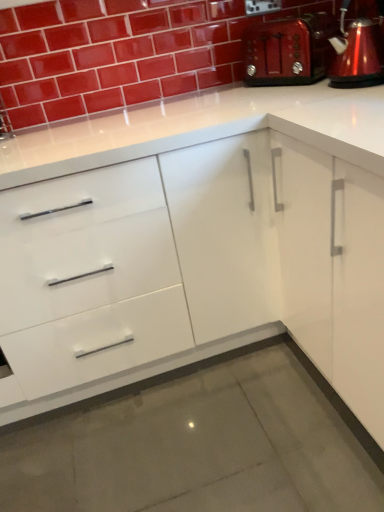
Question: Is glossy ceramic brick at upper center inside or outside of metallic red toaster at upper right?

Choices:
 (A) outside
 (B) inside

Answer: (A)

Question: Considering the positions of glossy ceramic brick at upper center and metallic red toaster at upper right in the image, is glossy ceramic brick at upper center wider or thinner than metallic red toaster at upper right?

Choices:
 (A) wide
 (B) thin

Answer: (B)

Question: Estimate the real-world distances between objects in this image. Which object is closer to the metallic red toaster at upper right?

Choices:
 (A) white glossy cabinet at center
 (B) glossy ceramic brick at upper center
 (C) metallic red coffeepot at upper right

Answer: (C)

Question: Which is nearer to the metallic red coffeepot at upper right?

Choices:
 (A) metallic red toaster at upper right
 (B) glossy ceramic brick at upper center
 (C) white glossy cabinet at center

Answer: (A)